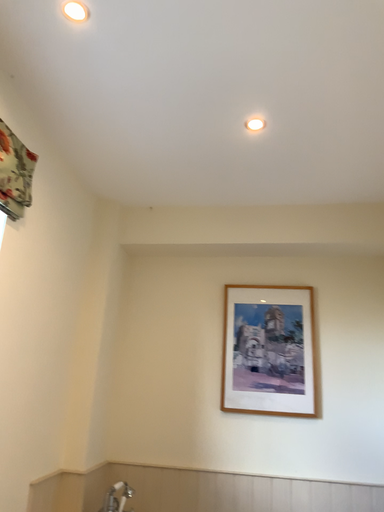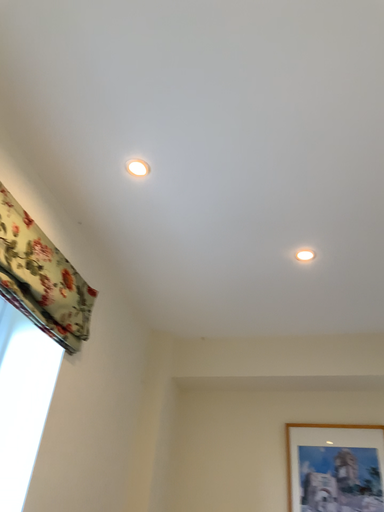
Question: How did the camera likely rotate when shooting the video?

Choices:
 (A) rotated downward
 (B) rotated upward

Answer: (B)